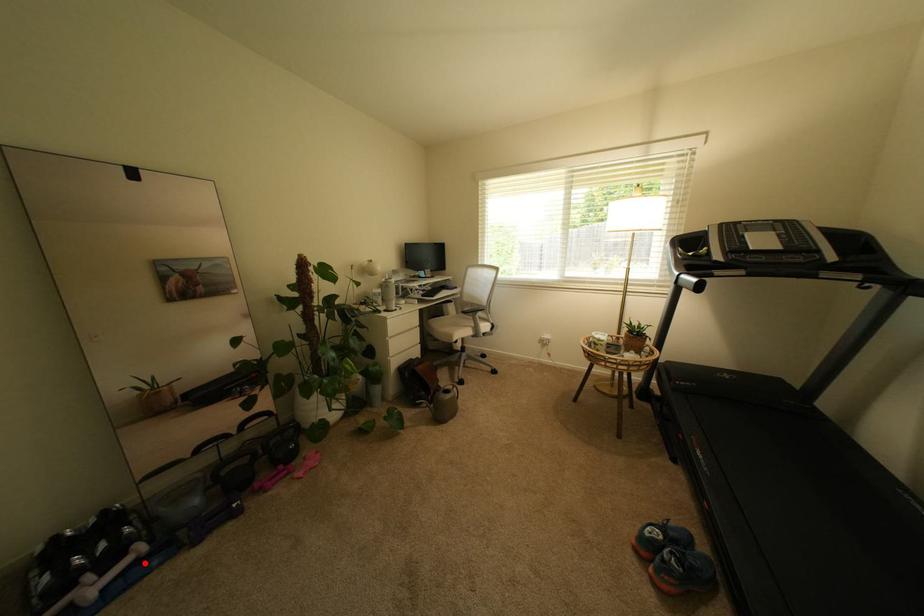
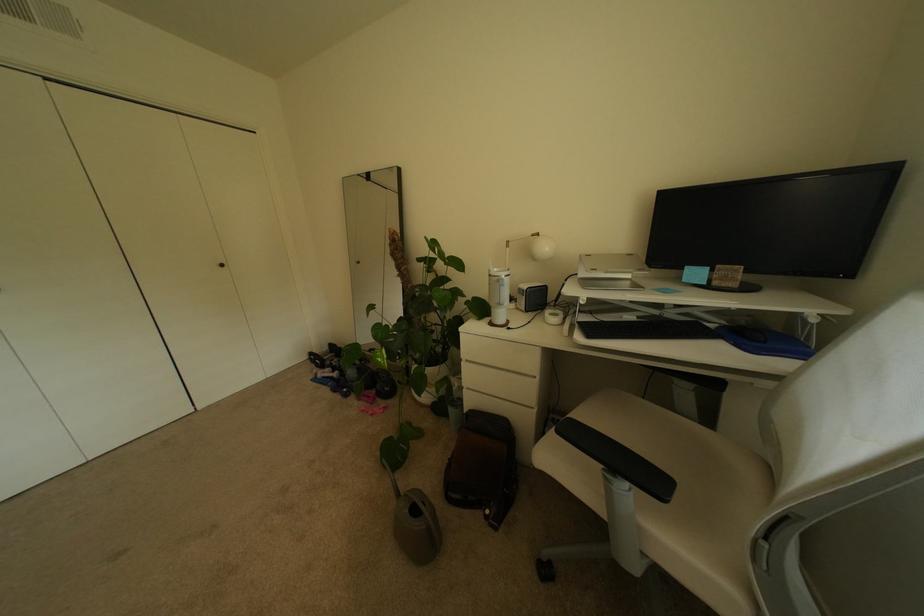
Find the pixel in the second image that matches the highlighted location in the first image.

(341, 379)